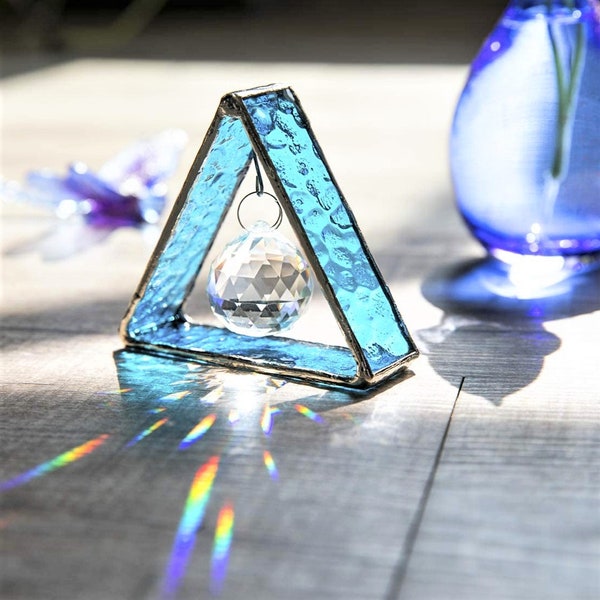
Where is `shadow of cup`? shadow of cup is located at coordinates (491, 371).